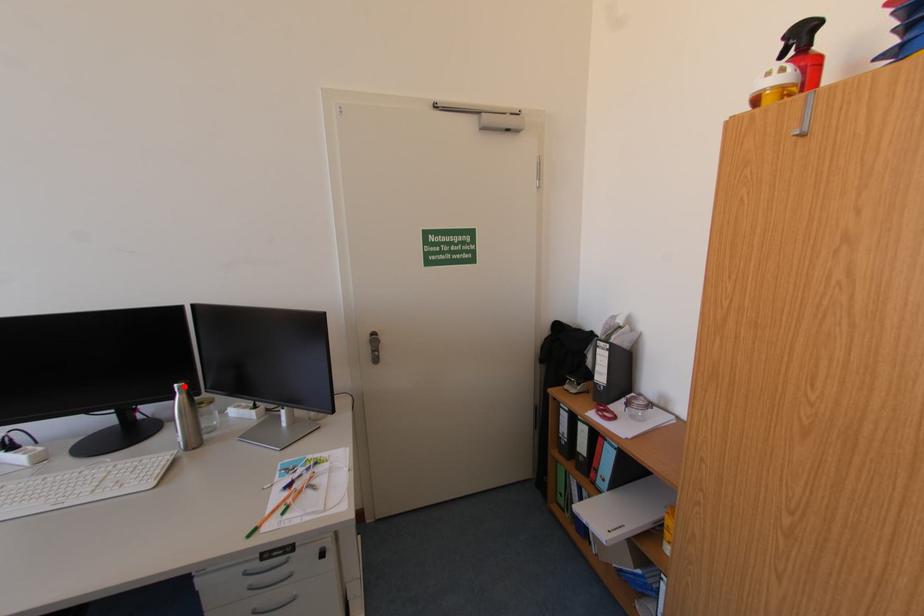
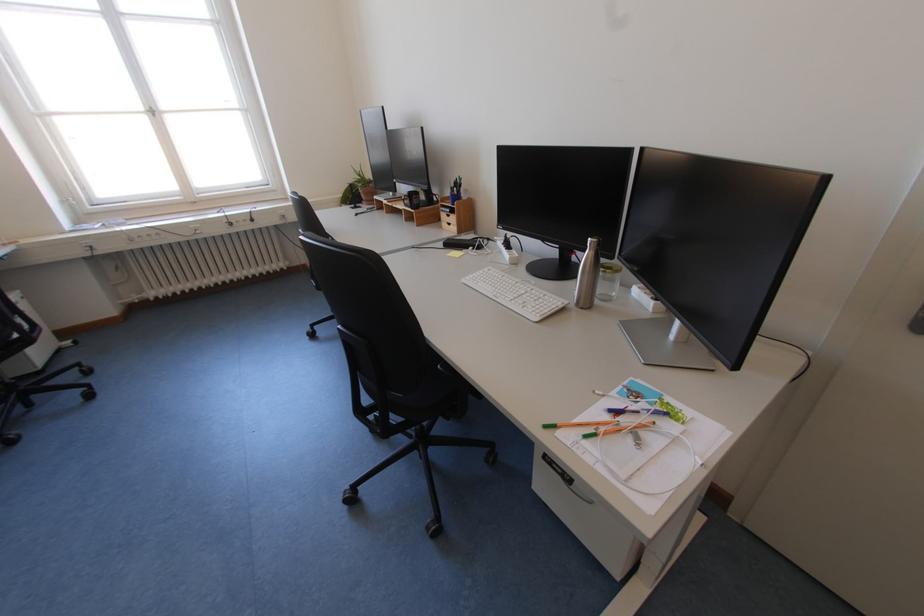
Where in the second image is the point corresponding to the highlighted location from the first image?

(599, 240)